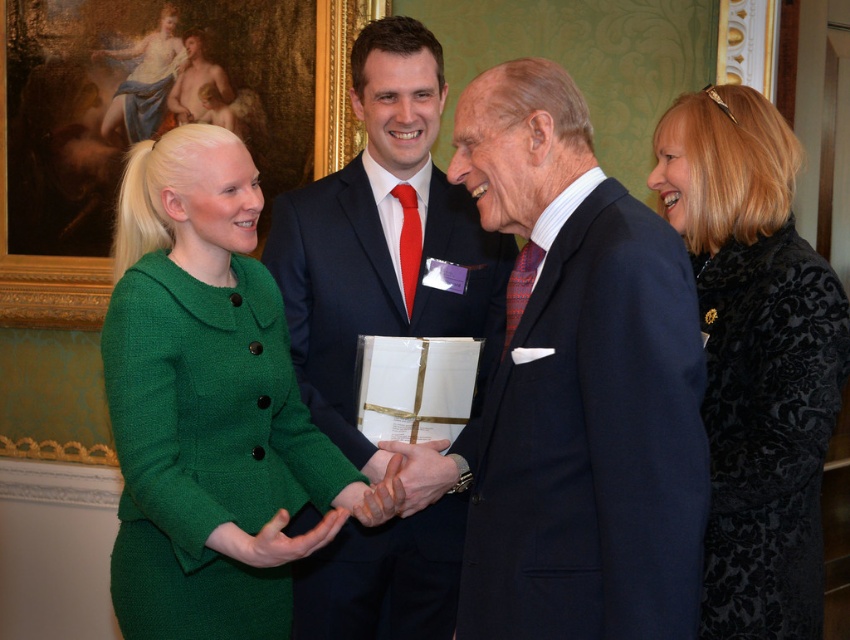
Does green woolen dress at center appear under navy wool suit at center?

Incorrect, green woolen dress at center is not positioned below navy wool suit at center.

Does green woolen dress at center appear on the left side of navy wool suit at center?

Correct, you'll find green woolen dress at center to the left of navy wool suit at center.

Is point (187, 371) closer to viewer compared to point (595, 419)?

No.

Image resolution: width=850 pixels, height=640 pixels. What are the coordinates of `green woolen dress at center` in the screenshot? It's located at (208, 404).

Which is in front, point (204, 381) or point (465, 332)?

Point (204, 381) is more forward.

Is green woolen dress at center in front of dark blue wool suit at center?

Yes, it is.

The width and height of the screenshot is (850, 640). Describe the element at coordinates (208, 404) in the screenshot. I see `green woolen dress at center` at that location.

The width and height of the screenshot is (850, 640). Find the location of `green woolen dress at center`. green woolen dress at center is located at coordinates (208, 404).

Which is behind, point (168, 374) or point (775, 516)?

Point (775, 516)

Consider the image. Is green woolen dress at center bigger than black velvet coat at right?

Indeed, green woolen dress at center has a larger size compared to black velvet coat at right.

Which is in front, point (114, 257) or point (707, 412)?

Positioned in front is point (707, 412).

Identify the location of green woolen dress at center. (208, 404).